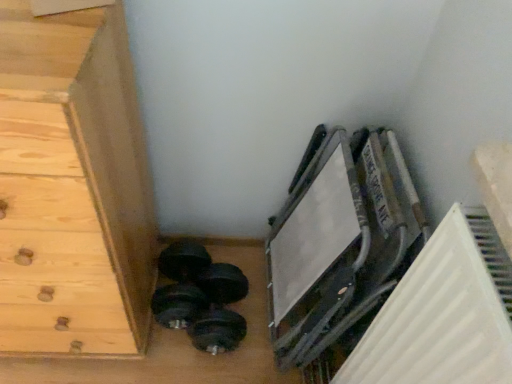
You are a GUI agent. You are given a task and a screenshot of the screen. Output one action in this format:
    pyautogui.click(x=<x>, y=<y>)
    Task: Click on the black rubber dumbbell at lower left
    
    Given the screenshot: What is the action you would take?
    pyautogui.click(x=200, y=297)

The image size is (512, 384). What do you see at coordinates (200, 297) in the screenshot? I see `black rubber dumbbell at lower left` at bounding box center [200, 297].

In order to face light wood chest of drawers at lower left, should I rotate leftwards or rightwards?

A 29.246 degree turn to the left will do.

What is the approximate height of light wood chest of drawers at lower left?

light wood chest of drawers at lower left is 1.15 meters in height.

The width and height of the screenshot is (512, 384). I want to click on light wood chest of drawers at lower left, so click(x=72, y=186).

Describe the element at coordinates (72, 186) in the screenshot. I see `light wood chest of drawers at lower left` at that location.

Find the location of `black rubber dumbbell at lower left`. black rubber dumbbell at lower left is located at coordinates (200, 297).

Considering the relative positions of black rubber dumbbell at lower left and light wood chest of drawers at lower left in the image provided, is black rubber dumbbell at lower left to the left of light wood chest of drawers at lower left from the viewer's perspective?

No.

Which object is further away from the camera taking this photo, black rubber dumbbell at lower left or light wood chest of drawers at lower left?

black rubber dumbbell at lower left is behind.

Considering the positions of points (227, 338) and (22, 96), is point (227, 338) closer to camera compared to point (22, 96)?

No, (227, 338) is further to viewer.

From the image's perspective, which object appears higher, black rubber dumbbell at lower left or light wood chest of drawers at lower left?

From the image's view, light wood chest of drawers at lower left is above.

From a real-world perspective, relative to light wood chest of drawers at lower left, is black rubber dumbbell at lower left vertically above or below?

In terms of real-world spatial position, black rubber dumbbell at lower left is below light wood chest of drawers at lower left.

Based on the photo, looking at their sizes, would you say black rubber dumbbell at lower left is wider or thinner than light wood chest of drawers at lower left?

In the image, black rubber dumbbell at lower left appears to be more narrow than light wood chest of drawers at lower left.

Considering the relative sizes of black rubber dumbbell at lower left and light wood chest of drawers at lower left in the image provided, is black rubber dumbbell at lower left shorter than light wood chest of drawers at lower left?

Correct, black rubber dumbbell at lower left is not as tall as light wood chest of drawers at lower left.

Is black rubber dumbbell at lower left smaller than light wood chest of drawers at lower left?

Yes, black rubber dumbbell at lower left is smaller than light wood chest of drawers at lower left.

From the picture: Is black rubber dumbbell at lower left spatially inside light wood chest of drawers at lower left, or outside of it?

black rubber dumbbell at lower left is not enclosed by light wood chest of drawers at lower left.

Is black rubber dumbbell at lower left far away from light wood chest of drawers at lower left?

They are positioned close to each other.

Could you tell me if black rubber dumbbell at lower left is turned towards light wood chest of drawers at lower left?

No, black rubber dumbbell at lower left is not facing towards light wood chest of drawers at lower left.

I want to click on dumbbell on the right of light wood chest of drawers at lower left, so click(x=200, y=297).

Can you confirm if light wood chest of drawers at lower left is positioned to the left of black rubber dumbbell at lower left?

Yes.

Between light wood chest of drawers at lower left and black rubber dumbbell at lower left, which one is positioned in front?

light wood chest of drawers at lower left.

Does point (88, 67) appear closer or farther from the camera than point (158, 309)?

Point (88, 67) appears to be closer to the viewer than point (158, 309).

From the picture: From the image's perspective, relative to black rubber dumbbell at lower left, is light wood chest of drawers at lower left above or below?

Clearly, from the image's perspective, light wood chest of drawers at lower left is above black rubber dumbbell at lower left.

From a real-world perspective, which is physically below, light wood chest of drawers at lower left or black rubber dumbbell at lower left?

black rubber dumbbell at lower left, from a real-world perspective.

Which object is thinner, light wood chest of drawers at lower left or black rubber dumbbell at lower left?

black rubber dumbbell at lower left.

Who is taller, light wood chest of drawers at lower left or black rubber dumbbell at lower left?

light wood chest of drawers at lower left is taller.

Who is bigger, light wood chest of drawers at lower left or black rubber dumbbell at lower left?

Bigger between the two is light wood chest of drawers at lower left.

Do you think light wood chest of drawers at lower left is within black rubber dumbbell at lower left, or outside of it?

light wood chest of drawers at lower left cannot be found inside black rubber dumbbell at lower left.

Would you consider light wood chest of drawers at lower left to be distant from black rubber dumbbell at lower left?

That's not correct — light wood chest of drawers at lower left is a little close to black rubber dumbbell at lower left.

Is light wood chest of drawers at lower left looking in the opposite direction of black rubber dumbbell at lower left?

No.

How many degrees apart are the facing directions of light wood chest of drawers at lower left and black rubber dumbbell at lower left?

2.57 degrees separate the facing orientations of light wood chest of drawers at lower left and black rubber dumbbell at lower left.

Could you measure the distance between light wood chest of drawers at lower left and black rubber dumbbell at lower left?

The distance of light wood chest of drawers at lower left from black rubber dumbbell at lower left is 15.13 inches.

Find the location of a particular element. This screenshot has height=384, width=512. chest of drawers in front of the black rubber dumbbell at lower left is located at coordinates (72, 186).

At what (x,y) coordinates should I click in order to perform the action: click on dumbbell that is on the right side of light wood chest of drawers at lower left. Please return your answer as a coordinate pair (x, y). This screenshot has height=384, width=512. Looking at the image, I should click on (200, 297).

The image size is (512, 384). In order to click on dumbbell directly beneath the light wood chest of drawers at lower left (from a real-world perspective) in this screenshot , I will do `click(200, 297)`.